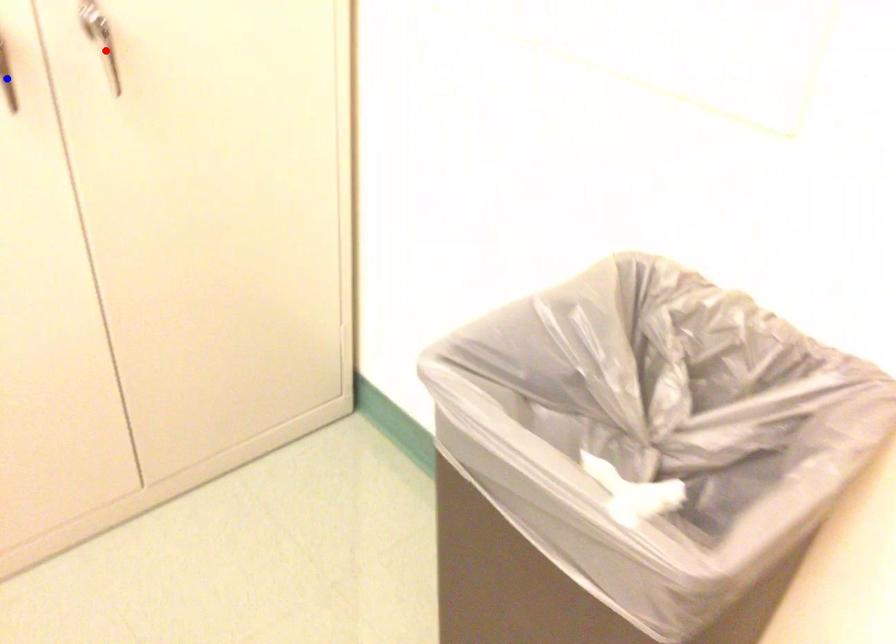
Question: Which of the two points in the image is closer to the camera?

Choices:
 (A) Blue point is closer.
 (B) Red point is closer.

Answer: (A)